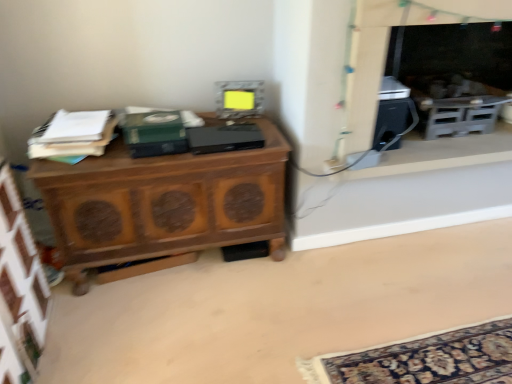
Locate an element on the screen. This screenshot has height=384, width=512. vacant area that is situated to the right of wooden cabinet at left is located at coordinates (327, 285).